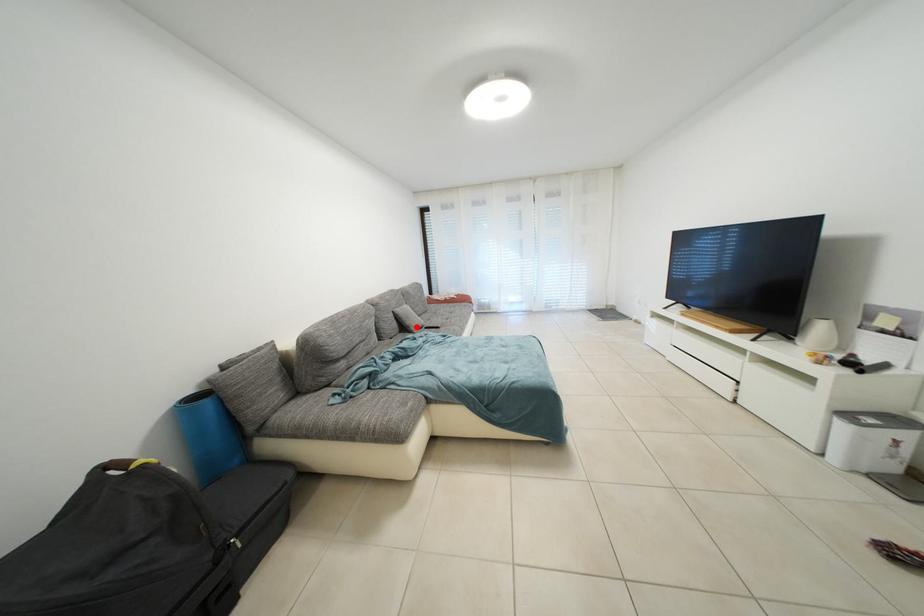
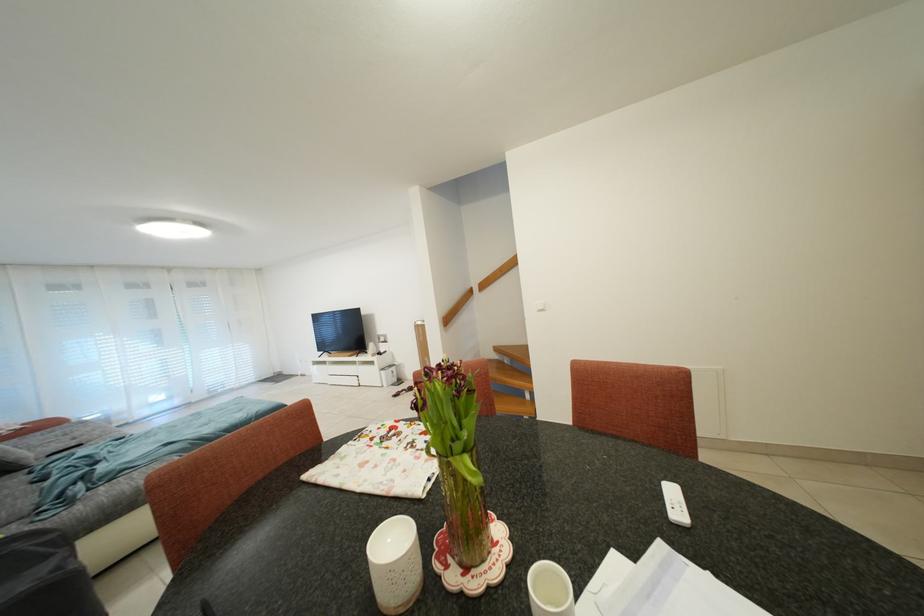
Question: I am providing you with two images of the same scene from different viewpoints. Given a red point in image1, look at the same physical point in image2. Is it:

Choices:
 (A) Closer to the viewpoint
 (B) Farther from the viewpoint

Answer: (B)